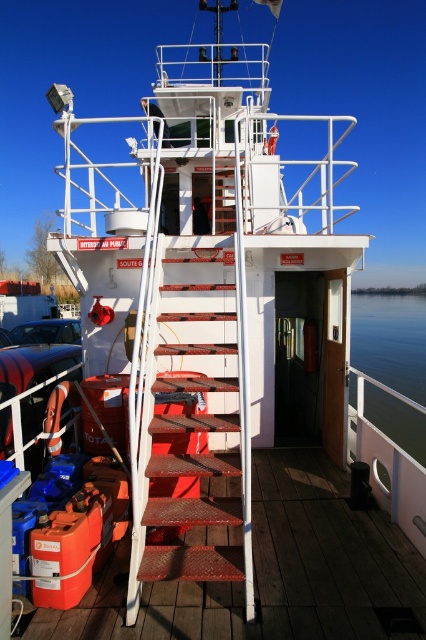
Who is more distant from viewer, (294, 488) or (357, 307)?

Point (357, 307)

Who is lower down, red metal stairs at center or green water at lower right?

red metal stairs at center is lower down.

This screenshot has width=426, height=640. Describe the element at coordinates (273, 572) in the screenshot. I see `red metal stairs at center` at that location.

Locate an element on the screen. The image size is (426, 640). red metal stairs at center is located at coordinates (273, 572).